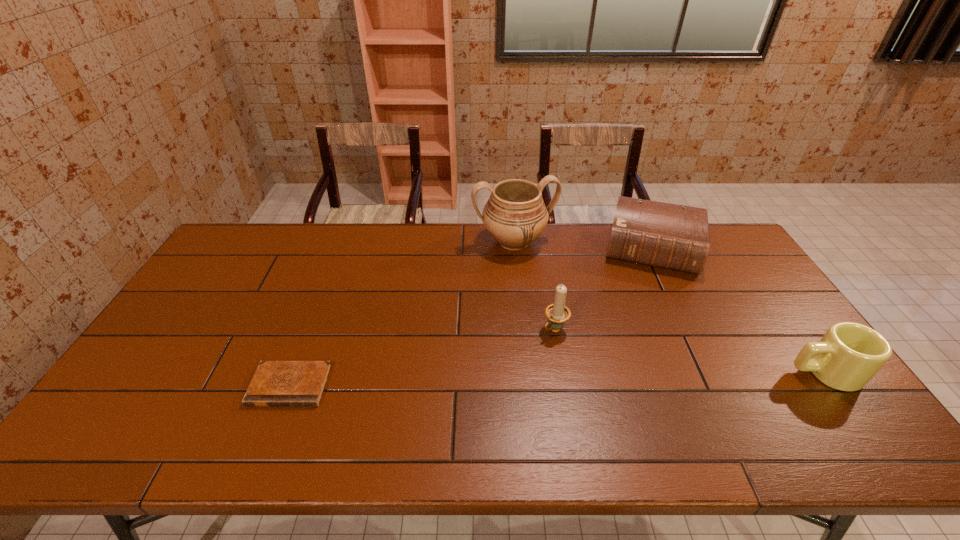
The height and width of the screenshot is (540, 960). What are the coordinates of `free region located on the front-facing side of the tallest object` in the screenshot? It's located at (540, 299).

Identify the location of free space located on the front-facing side of the tallest object. (542, 305).

The height and width of the screenshot is (540, 960). I want to click on free point located on the front-facing side of the tallest object, so click(540, 301).

I want to click on vacant space situated 0.270m on the handle side of the third nearest object, so click(x=480, y=396).

You are a GUI agent. You are given a task and a screenshot of the screen. Output one action in this format:
    pyautogui.click(x=<x>, y=<y>)
    Task: Click on the free location located 0.060m on the handle side of the third nearest object
    
    Given the screenshot: What is the action you would take?
    pyautogui.click(x=533, y=349)

Locate an element on the screen. The width and height of the screenshot is (960, 540). free location located on the handle side of the third nearest object is located at coordinates (496, 381).

The width and height of the screenshot is (960, 540). I want to click on free space located 0.220m on the spine side of the Bible, so [x=643, y=326].

Image resolution: width=960 pixels, height=540 pixels. I want to click on vacant area situated 0.070m on the spine side of the Bible, so click(x=647, y=293).

You are a GUI agent. You are given a task and a screenshot of the screen. Output one action in this format:
    pyautogui.click(x=<x>, y=<y>)
    Task: Click on the vacant space located 0.120m on the spine side of the Bible
    This screenshot has height=540, width=960.
    Given the screenshot: What is the action you would take?
    pyautogui.click(x=646, y=303)

This screenshot has width=960, height=540. Identify the location of urn that is positioned at the far edge. (515, 215).